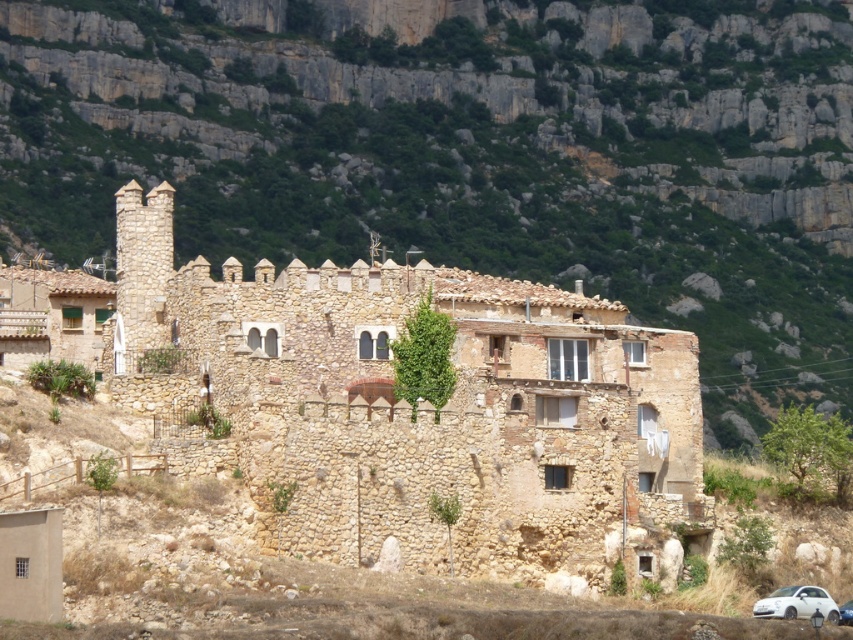
Question: Which of the following is the closest to the observer?

Choices:
 (A) (840, 611)
 (B) (263, 435)
 (C) (781, 614)

Answer: (C)

Question: Which object appears closest to the camera in this image?

Choices:
 (A) white matte car at lower right
 (B) gray rocky mountain at upper center

Answer: (A)

Question: Is gray rocky mountain at upper center positioned before brown stone fort at center?

Choices:
 (A) no
 (B) yes

Answer: (A)

Question: Which object appears closest to the camera in this image?

Choices:
 (A) metallic blue car at lower right
 (B) white matte car at lower right

Answer: (A)

Question: Is white matte car at lower right bigger than metallic blue car at lower right?

Choices:
 (A) yes
 (B) no

Answer: (A)

Question: Is gray rocky mountain at upper center in front of white matte car at lower right?

Choices:
 (A) no
 (B) yes

Answer: (A)